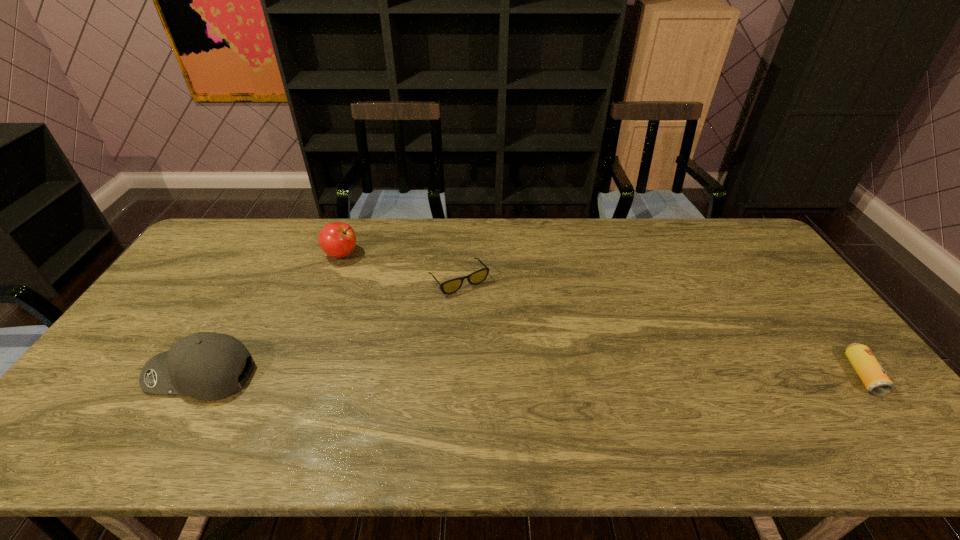
You are a GUI agent. You are given a task and a screenshot of the screen. Output one action in this format:
    pyautogui.click(x=<x>, y=<y>)
    Task: Click on the free point between the apple and the beer can
    
    Given the screenshot: What is the action you would take?
    pyautogui.click(x=602, y=314)

Locate an element on the screen. unoccupied area between the leftmost object and the rightmost object is located at coordinates (532, 375).

The image size is (960, 540). What are the coordinates of `vacant area that lies between the apple and the sunglasses` in the screenshot? It's located at (400, 267).

The image size is (960, 540). Find the location of `object that ranks as the third closest to the third object from left to right`. object that ranks as the third closest to the third object from left to right is located at coordinates (871, 373).

Where is `the closest object to the baseball cap`? The image size is (960, 540). the closest object to the baseball cap is located at coordinates (336, 239).

Find the location of a particular element. This screenshot has width=960, height=540. blank space that satisfies the following two spatial constraints: 1. on the front side of the sunglasses; 2. on the left side of the third object from right to left is located at coordinates (331, 280).

I want to click on free space that satisfies the following two spatial constraints: 1. on the front side of the apple; 2. on the right side of the rightmost object, so click(x=295, y=375).